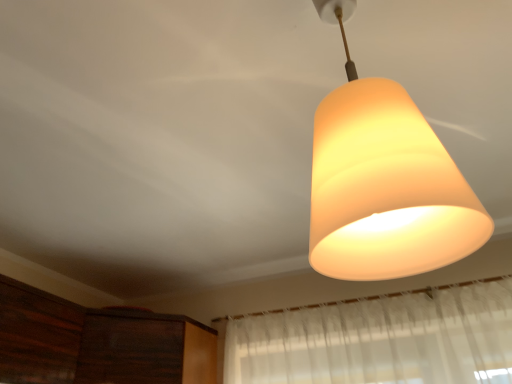
Describe the element at coordinates (384, 183) in the screenshot. I see `matte yellow glass lampshade at upper center` at that location.

Locate an element on the screen. The width and height of the screenshot is (512, 384). matte yellow glass lampshade at upper center is located at coordinates (384, 183).

Where is `matte yellow glass lampshade at upper center`? matte yellow glass lampshade at upper center is located at coordinates (384, 183).